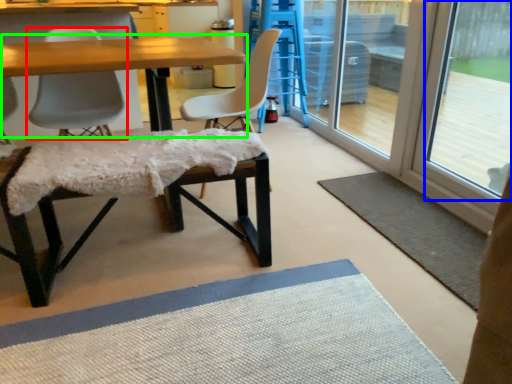
Question: Estimate the real-world distances between objects in this image. Which object is closer to chair (highlighted by a red box), window screen (highlighted by a blue box) or table (highlighted by a green box)?

Choices:
 (A) window screen
 (B) table

Answer: (B)